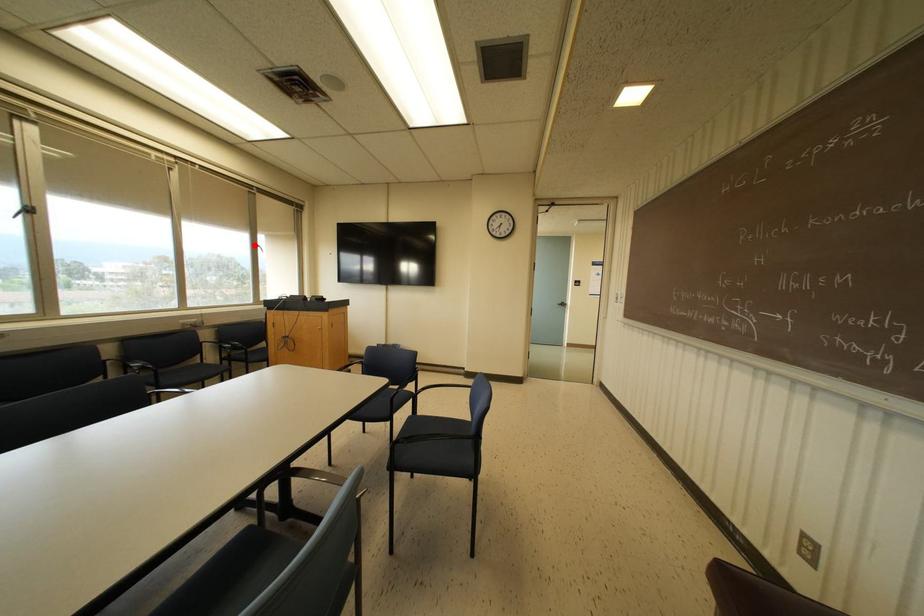
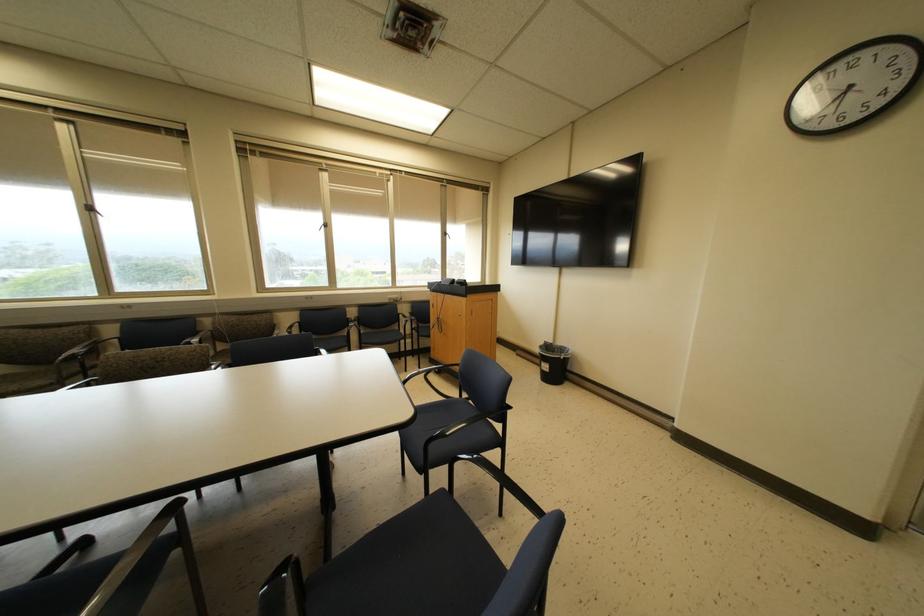
Find the pixel in the second image that matches the highlighted location in the first image.

(444, 233)